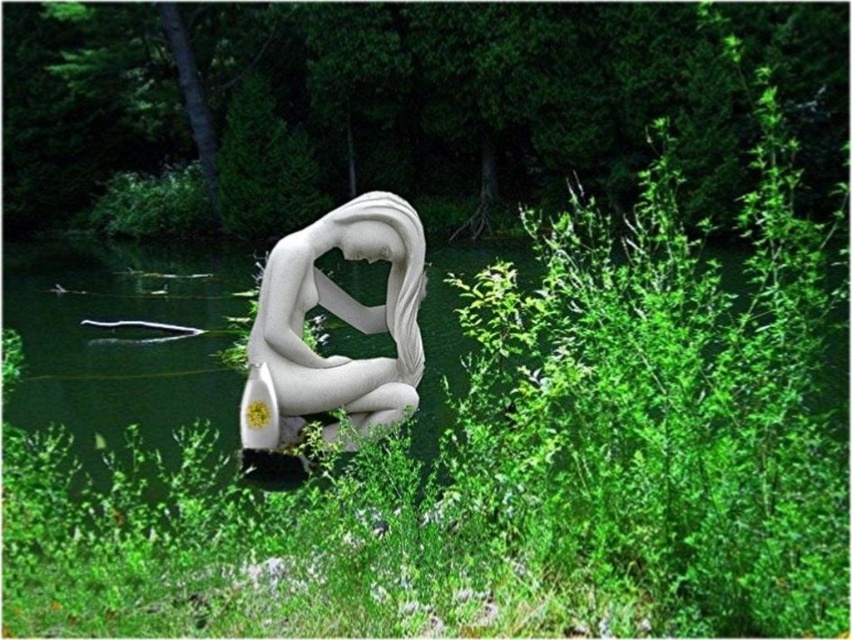
Who is more distant from viewer, (384, 120) or (327, 300)?

The point (384, 120) is behind.

Who is more forward, (786, 16) or (413, 337)?

Point (413, 337) is more forward.

You are a GUI agent. You are given a task and a screenshot of the screen. Output one action in this format:
    pyautogui.click(x=<x>, y=<y>)
    Task: Click on the green leafy shrubs at center
    
    Given the screenshot: What is the action you would take?
    pyautogui.click(x=392, y=106)